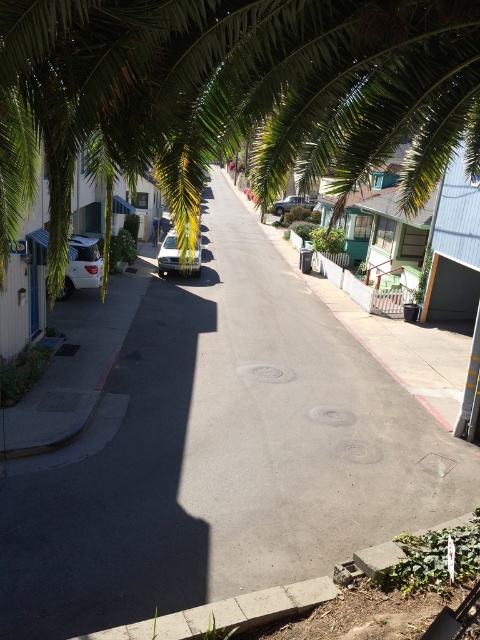
Question: Is silver metallic car at center smaller than silver metallic sedan at center?

Choices:
 (A) yes
 (B) no

Answer: (B)

Question: Does silver metallic car at left have a larger size compared to silver metallic car at center?

Choices:
 (A) yes
 (B) no

Answer: (B)

Question: Which point appears closest to the camera in this image?

Choices:
 (A) (86, 284)
 (B) (301, 422)

Answer: (B)

Question: From the image, what is the correct spatial relationship of silver metallic car at left in relation to silver metallic car at center?

Choices:
 (A) above
 (B) below

Answer: (B)

Question: Based on their relative distances, which object is farther from the silver metallic sedan at center?

Choices:
 (A) gray asphalt pavement at center
 (B) silver metallic car at left

Answer: (B)

Question: Considering the real-world distances, which object is closest to the silver metallic car at center?

Choices:
 (A) gray asphalt pavement at center
 (B) silver metallic sedan at center

Answer: (A)